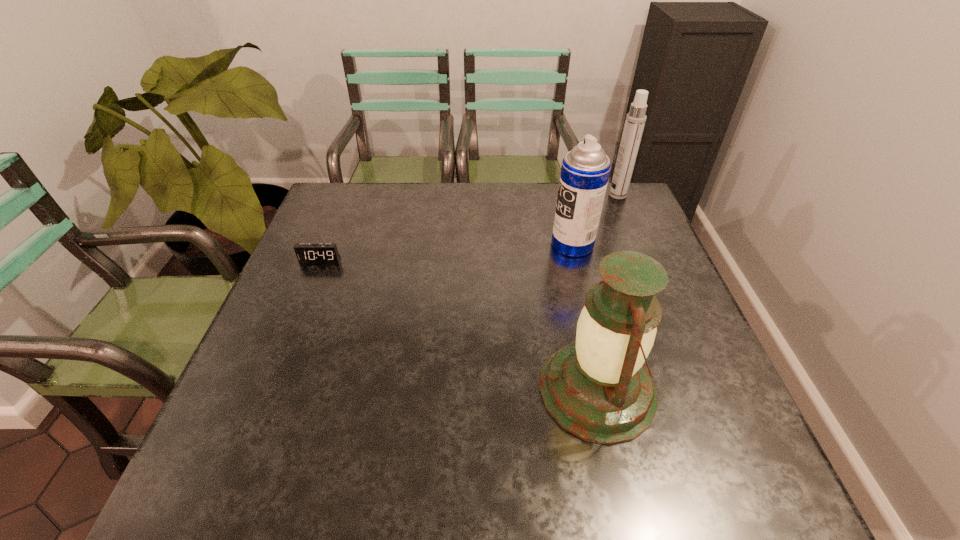
In order to click on the farthest object in this screenshot , I will do `click(635, 120)`.

You are a GUI agent. You are given a task and a screenshot of the screen. Output one action in this format:
    pyautogui.click(x=<x>, y=<y>)
    Task: Click on the rightmost object
    The image size is (960, 540).
    Given the screenshot: What is the action you would take?
    pyautogui.click(x=635, y=120)

Identify the location of the nearest object. [x=597, y=388].

This screenshot has width=960, height=540. Find the location of `the nearer aerosol can`. the nearer aerosol can is located at coordinates (585, 170).

Identify the location of the leftmost object. point(305,252).

You are a GUI agent. You are given a task and a screenshot of the screen. Output one action in this format:
    pyautogui.click(x=<x>, y=<y>)
    Task: Click on the alarm clock
    This screenshot has width=960, height=540.
    Given the screenshot: What is the action you would take?
    pyautogui.click(x=305, y=252)

The width and height of the screenshot is (960, 540). I want to click on blank space located on the back of the farthest object, so click(x=612, y=183).

Locate an element on the screen. vacant space situated with the light compartment facing forward on the lantern is located at coordinates (441, 390).

Identify the location of vacant area situated 0.320m with the light compartment facing forward on the lantern. This screenshot has height=540, width=960. (382, 390).

Locate an element on the screen. Image resolution: width=960 pixels, height=540 pixels. vacant space located 0.230m with the light compartment facing forward on the lantern is located at coordinates (426, 390).